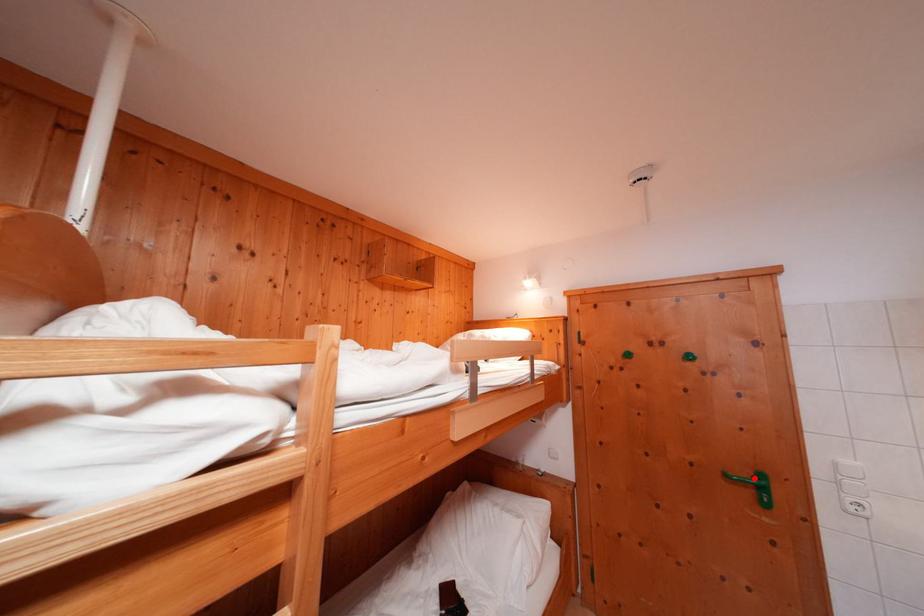
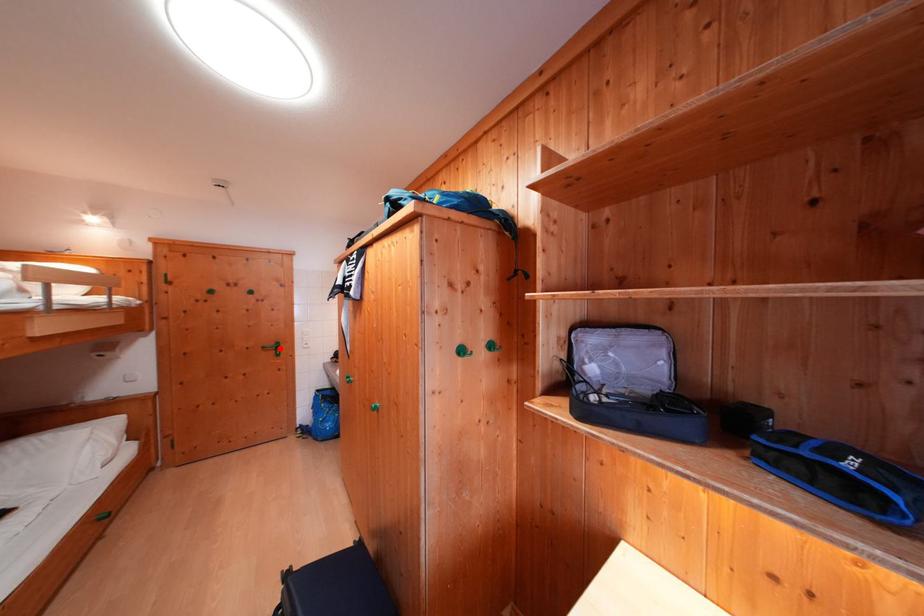
I am providing you with two images of the same scene from different viewpoints. A red point is marked on the first image and another point is marked on the second image. Is the marked point in image1 the same physical position as the marked point in image2?

Yes